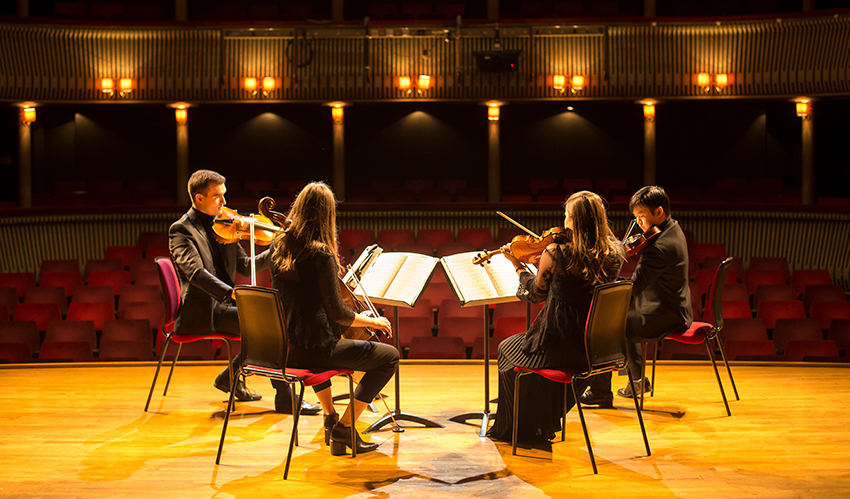
At what (x,y) coordinates should I click in order to perform the action: click on projector. Please return your answer as a coordinate pair (x, y). The image size is (850, 499). Looking at the image, I should click on (497, 69).